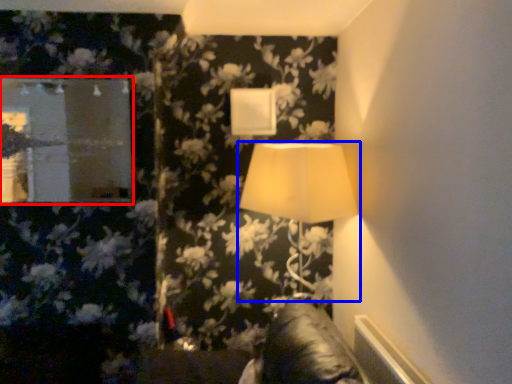
Question: Which object is closer to the camera taking this photo, mirror (highlighted by a red box) or lamp (highlighted by a blue box)?

Choices:
 (A) mirror
 (B) lamp

Answer: (B)